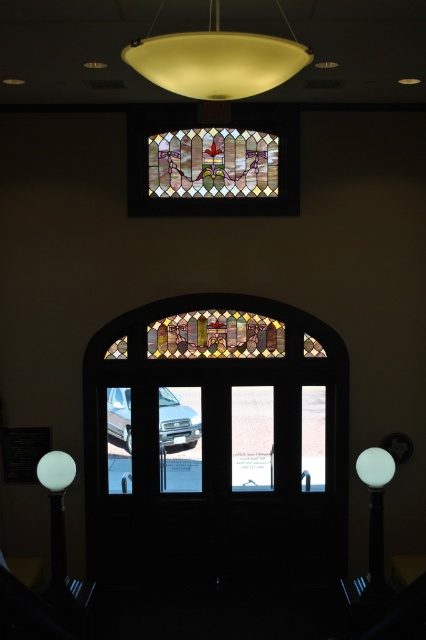
Who is shorter, stained glass window at upper center or white glossy lamp post at lower left?

With less height is stained glass window at upper center.

Is stained glass window at upper center in front of white glossy lamp post at lower left?

No, stained glass window at upper center is behind white glossy lamp post at lower left.

Where is `stained glass window at upper center`? The width and height of the screenshot is (426, 640). stained glass window at upper center is located at coordinates (213, 163).

You are a GUI agent. You are given a task and a screenshot of the screen. Output one action in this format:
    pyautogui.click(x=<x>, y=<y>)
    Task: Click on the stained glass window at center
    
    Given the screenshot: What is the action you would take?
    pyautogui.click(x=215, y=442)

Is point (273, 458) in front of point (106, 403)?

That is False.

Who is more distant from viewer, (166, 564) or (167, 413)?

Positioned behind is point (167, 413).

At what (x,y) coordinates should I click in order to perform the action: click on stained glass window at center. Please return your answer as a coordinate pair (x, y). This screenshot has height=640, width=426. Looking at the image, I should click on (215, 442).

The image size is (426, 640). Describe the element at coordinates (176, 422) in the screenshot. I see `silver metallic car at center` at that location.

Between silver metallic car at center and white glossy sphere at lower left, which one is positioned higher?

Positioned higher is silver metallic car at center.

Between point (111, 422) and point (40, 481), which one is positioned in front?

Point (40, 481) is in front.

Where is `silver metallic car at center`? The width and height of the screenshot is (426, 640). silver metallic car at center is located at coordinates (176, 422).